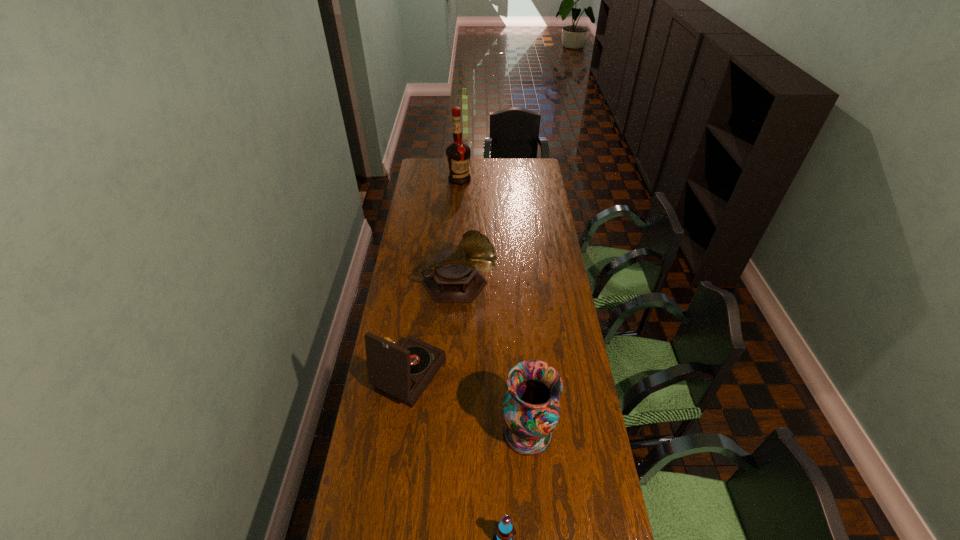
The width and height of the screenshot is (960, 540). What are the coordinates of `free spot that satisfies the following two spatial constraints: 1. on the front and back of the tallest object; 2. on the right side of the vase` in the screenshot? It's located at (444, 432).

Locate an element on the screen. vacant area that satisfies the following two spatial constraints: 1. on the horn direction of the farther phonograph record; 2. on the left side of the vase is located at coordinates (451, 432).

Identify the location of free region that satisfies the following two spatial constraints: 1. on the horn direction of the vase; 2. on the left side of the farther phonograph record. This screenshot has width=960, height=540. (451, 432).